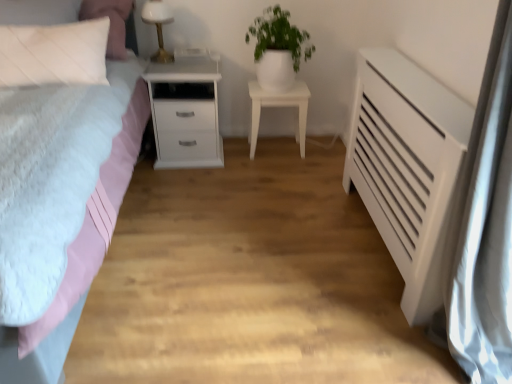
Find the location of `vacant area that is in front of white matte nightstand at left, the 2th nightstand in the right-to-left sequence`. vacant area that is in front of white matte nightstand at left, the 2th nightstand in the right-to-left sequence is located at coordinates (x=188, y=186).